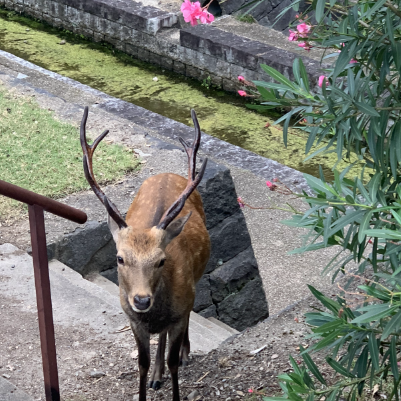
Where is `stairs`? The height and width of the screenshot is (401, 401). stairs is located at coordinates (205, 342), (216, 333), (228, 328).